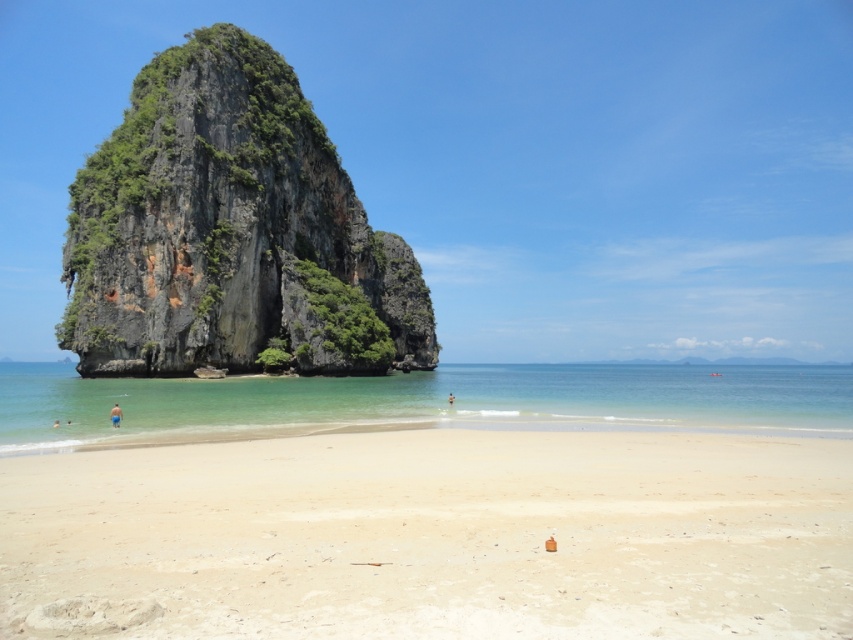
Who is positioned more to the right, green mossy rock at center or blue fabric shorts at lower left?

Positioned to the right is green mossy rock at center.

Does green mossy rock at center have a smaller size compared to blue fabric shorts at lower left?

Actually, green mossy rock at center might be larger than blue fabric shorts at lower left.

This screenshot has height=640, width=853. I want to click on green mossy rock at center, so click(x=230, y=230).

Is point (114, 417) less distant than point (451, 397)?

Yes, it is in front of point (451, 397).

Between blue fabric shorts at lower left and skinny person at center, which one is positioned higher?

blue fabric shorts at lower left is higher up.

Who is more distant from viewer, (114,424) or (450,397)?

The point (450,397) is behind.

The height and width of the screenshot is (640, 853). In order to click on blue fabric shorts at lower left in this screenshot , I will do `click(115, 416)`.

Which is more to the left, light beige sand at center or clear blue water at center?

Positioned to the left is light beige sand at center.

Find the location of a particular element. This screenshot has height=640, width=853. light beige sand at center is located at coordinates (432, 536).

Locate an element on the screen. light beige sand at center is located at coordinates (432, 536).